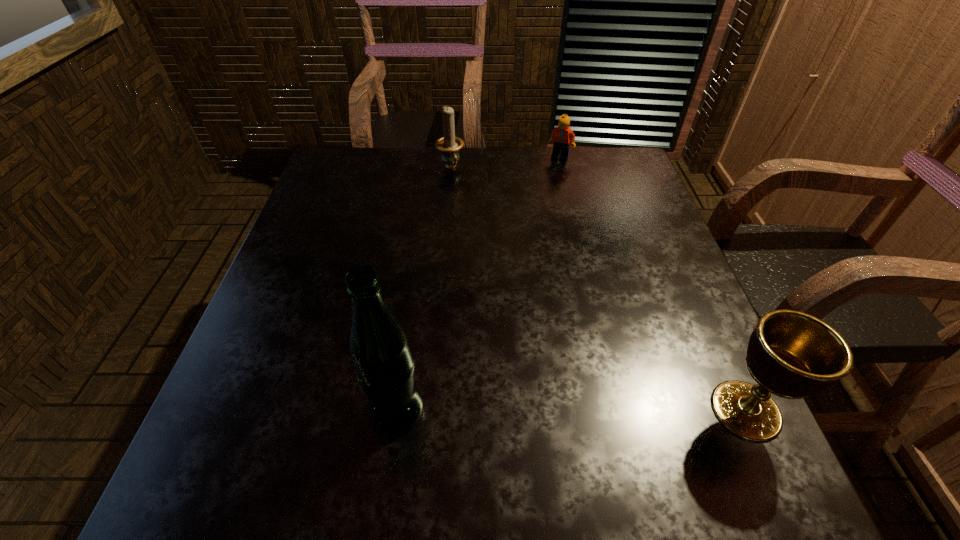
At what (x,y) coordinates should I click in order to perform the action: click on vacant space located 0.100m on the handle side of the candle_holder. Please return your answer as a coordinate pair (x, y). The height and width of the screenshot is (540, 960). Looking at the image, I should click on (466, 197).

You are a GUI agent. You are given a task and a screenshot of the screen. Output one action in this format:
    pyautogui.click(x=<x>, y=<y>)
    Task: Click on the free location located 0.170m on the handle side of the candle_holder
    The height and width of the screenshot is (540, 960).
    Given the screenshot: What is the action you would take?
    pyautogui.click(x=474, y=212)

At what (x,y) coordinates should I click in order to perform the action: click on free point located 0.090m on the handle side of the candle_holder. Please return your answer as a coordinate pair (x, y). Looking at the image, I should click on (465, 194).

Identify the location of Lego present at the far edge. (561, 136).

Locate an element on the screen. The image size is (960, 540). candle_holder present at the far edge is located at coordinates (449, 145).

Where is `beer bottle present at the near edge`? This screenshot has width=960, height=540. beer bottle present at the near edge is located at coordinates (384, 364).

Find the location of a particular element. The image size is (960, 540). chalice located in the near edge section of the desktop is located at coordinates (791, 354).

The image size is (960, 540). Find the location of `object that is at the right edge`. object that is at the right edge is located at coordinates (791, 354).

Locate an element on the screen. The height and width of the screenshot is (540, 960). object at the near right corner is located at coordinates (791, 354).

Identify the location of vacant space at the far edge. (417, 179).